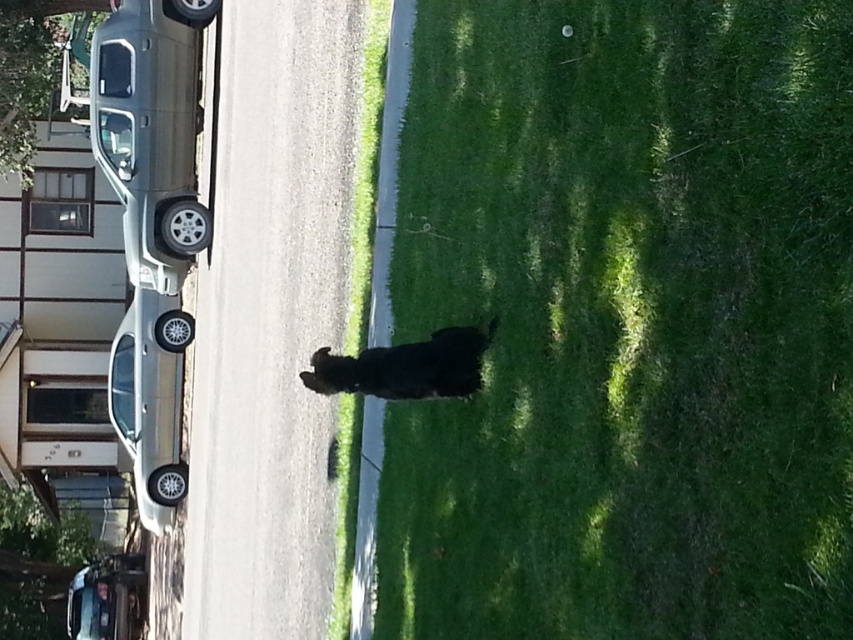
You are a delivery person trying to park your van in the driveway. The driveway is narrow and can only fit one vehicle. You see the silver metallic car at left and the metallic silver sedan at lower left. Which vehicle should you ask the owner to move so you can park your van?

The silver metallic car at left is positioned over the metallic silver sedan at lower left, so you should ask the owner of the silver metallic car at left to move it first to make space for your van.

You are standing at the point labeled point [741,435] and want to walk to the point labeled point [74,637]. Which direction should you face to walk directly towards your destination?

You should face downward because point [741,435] is in front of point [74,637].